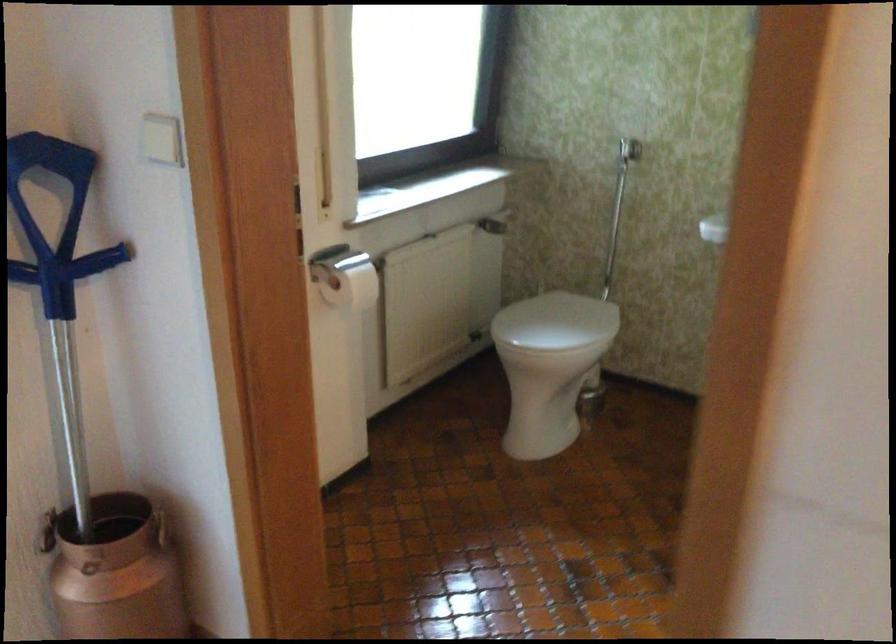
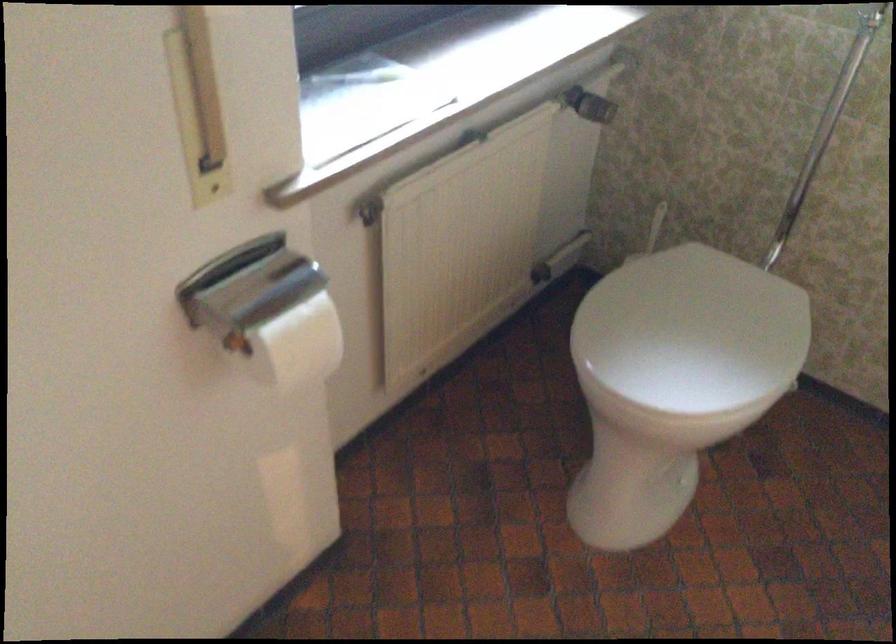
Find the pixel in the second image that matches (556,321) in the first image.

(692, 330)